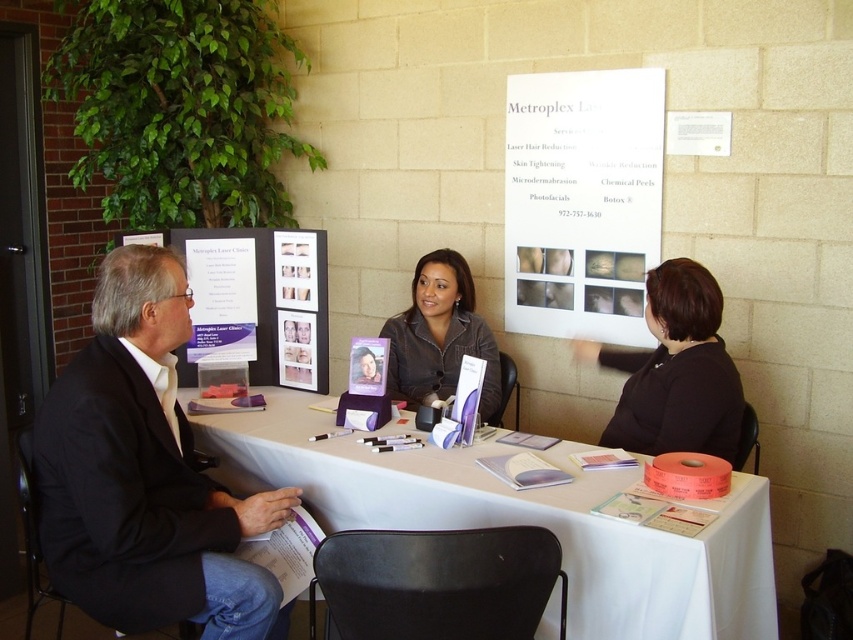
You are attending a health fair and need to place a new folder on the table. The folder is too heavy to hold, so you must set it down. Which object should you place it on, the white paper table at lower center or the matte gray jacket at center?

The white paper table at lower center is closer to the viewer and more appropriate for placing the folder since it is a stable surface, whereas the matte gray jacket at center is likely worn by a person and not meant for holding items.

You are a participant at the health event and want to read the information on the white paper at upper center and the matte purple brochure at center. Which one can you see more clearly without moving your head?

The white paper at upper center is closer to the viewer than the matte purple brochure at center, so you can see the white paper at upper center more clearly without moving your head.

You are standing in front of the table at the health event. You notice two points marked on the table surface. Which point is closer to you, point (122,506) or point (206,241)?

Point (122,506) is closer to you than point (206,241).